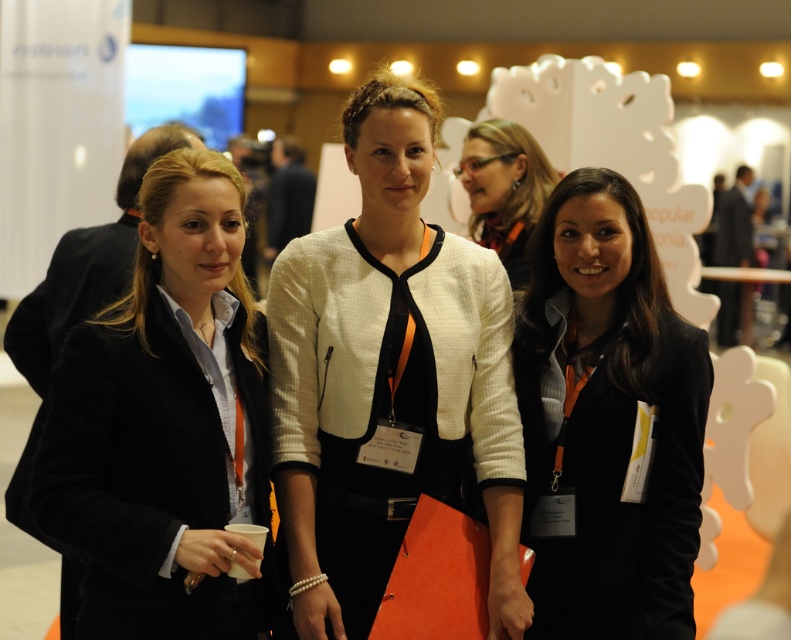
Which of these two, velvet black jacket at left or black matte blazer at center, stands shorter?

velvet black jacket at left is shorter.

Can you confirm if velvet black jacket at left is positioned below black matte blazer at center?

→ Actually, velvet black jacket at left is above black matte blazer at center.

Based on the photo, who is more distant from viewer, (184, 337) or (577, 314)?

Point (577, 314)

Where is `velvet black jacket at left`? This screenshot has height=640, width=791. velvet black jacket at left is located at coordinates (163, 420).

Can you confirm if white textured blazer at center is smaller than black matte blazer at center?

No, white textured blazer at center is not smaller than black matte blazer at center.

Does white textured blazer at center appear under black matte blazer at center?

No, white textured blazer at center is not below black matte blazer at center.

Between point (339, 570) and point (653, 477), which one is positioned in front?

Point (339, 570)

The height and width of the screenshot is (640, 791). I want to click on white textured blazer at center, so [388, 378].

Can you confirm if velvet black jacket at left is bigger than matte black jacket at center?

Indeed, velvet black jacket at left has a larger size compared to matte black jacket at center.

Is velvet black jacket at left wider than matte black jacket at center?

Indeed, velvet black jacket at left has a greater width compared to matte black jacket at center.

Identify the location of velvet black jacket at left. The width and height of the screenshot is (791, 640). (163, 420).

Image resolution: width=791 pixels, height=640 pixels. In order to click on velvet black jacket at left in this screenshot , I will do `click(163, 420)`.